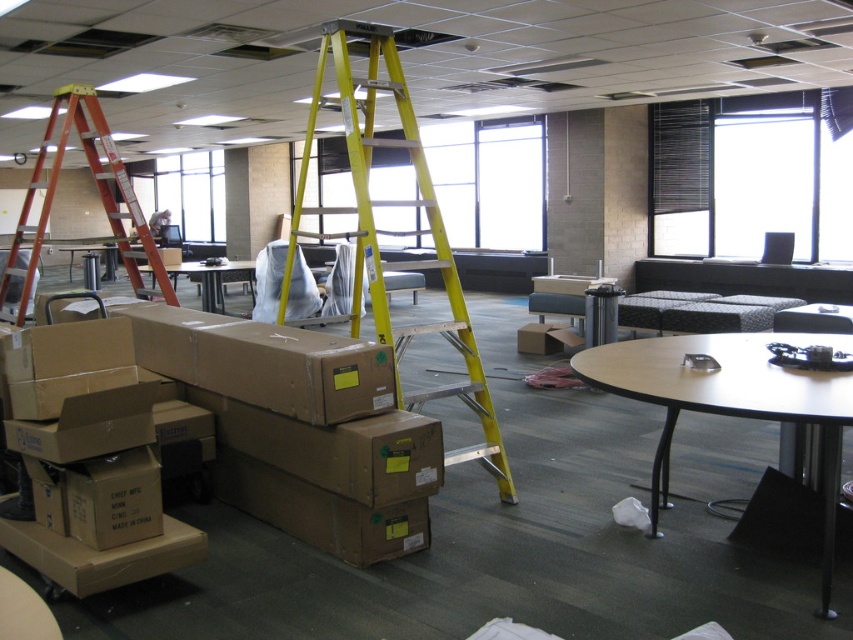
Between yellow metallic ladder at center and black plastic table at lower right, which one appears on the right side from the viewer's perspective?

From the viewer's perspective, black plastic table at lower right appears more on the right side.

Locate an element on the screen. The height and width of the screenshot is (640, 853). yellow metallic ladder at center is located at coordinates (392, 230).

Which is behind, point (364, 172) or point (764, 333)?

Point (764, 333)

I want to click on yellow metallic ladder at center, so click(x=392, y=230).

Is orange metallic ladder at left taller than matte cardboard table at center?

Correct, orange metallic ladder at left is much taller as matte cardboard table at center.

Between orange metallic ladder at left and matte cardboard table at center, which one is positioned higher?

orange metallic ladder at left is above.

The height and width of the screenshot is (640, 853). In order to click on orange metallic ladder at left in this screenshot , I will do `click(97, 193)`.

Locate an element on the screen. This screenshot has height=640, width=853. orange metallic ladder at left is located at coordinates (97, 193).

Between point (772, 332) and point (200, 296), which one is positioned in front?

Positioned in front is point (772, 332).

Is black plastic table at lower right positioned before matte cardboard table at center?

Yes, it is in front of matte cardboard table at center.

Between point (819, 372) and point (200, 291), which one is positioned behind?

The point (200, 291) is more distant.

Where is `black plastic table at lower right`? black plastic table at lower right is located at coordinates (730, 401).